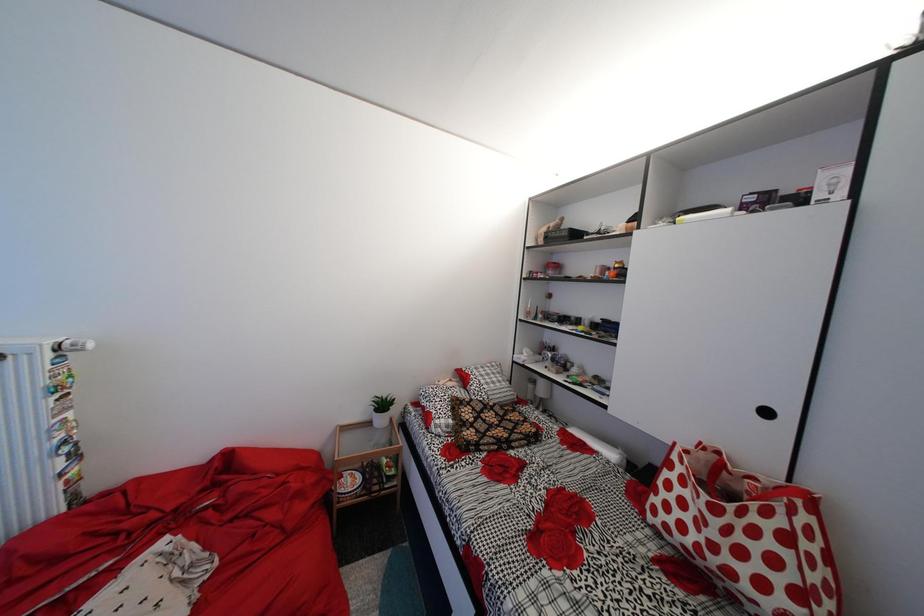
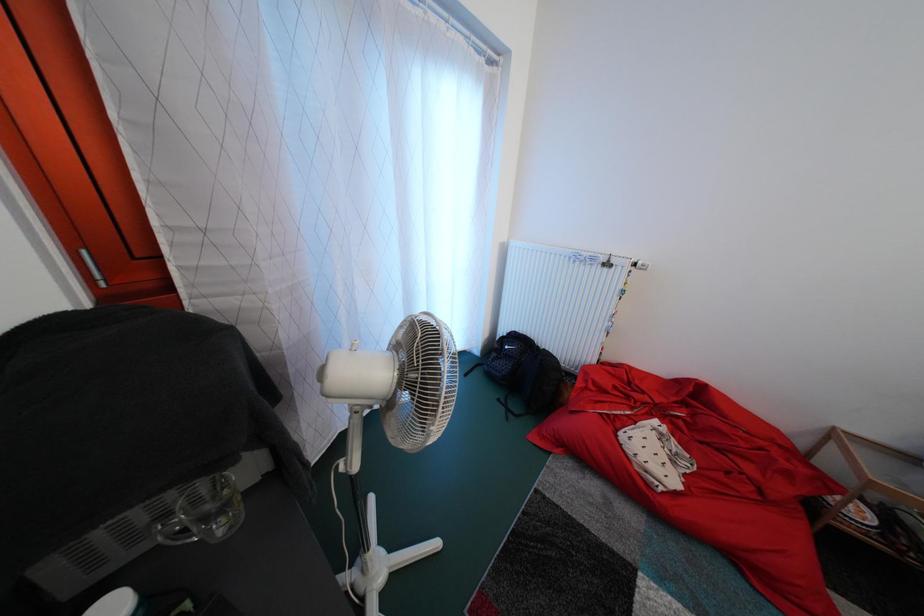
How did the camera likely rotate?

The rotation direction of the camera is left-down.